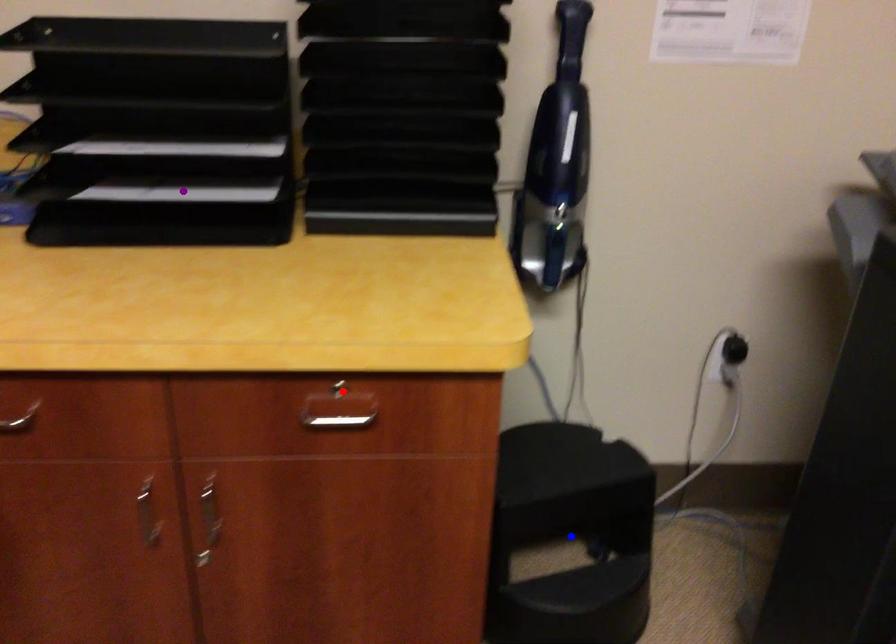
Order these from farthest to nearest:
- blue point
- purple point
- red point

blue point → purple point → red point